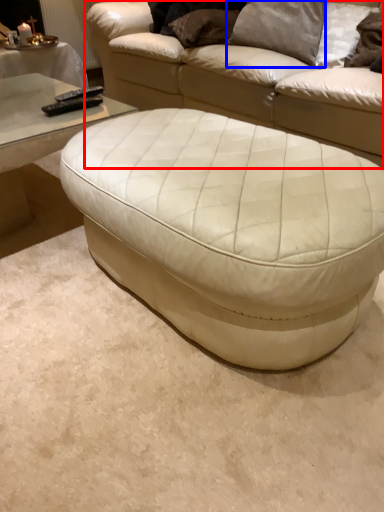
Question: Among these objects, which one is nearest to the camera, studio couch (highlighted by a red box) or pillow (highlighted by a blue box)?

Choices:
 (A) studio couch
 (B) pillow

Answer: (A)